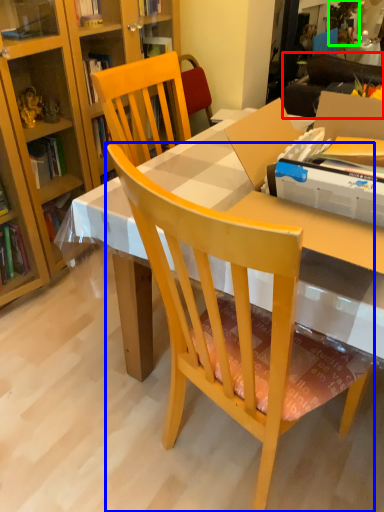
Question: Which is nearer to the studio couch (highlighted by a red box)? chair (highlighted by a blue box) or houseplant (highlighted by a green box).

Choices:
 (A) chair
 (B) houseplant

Answer: (B)